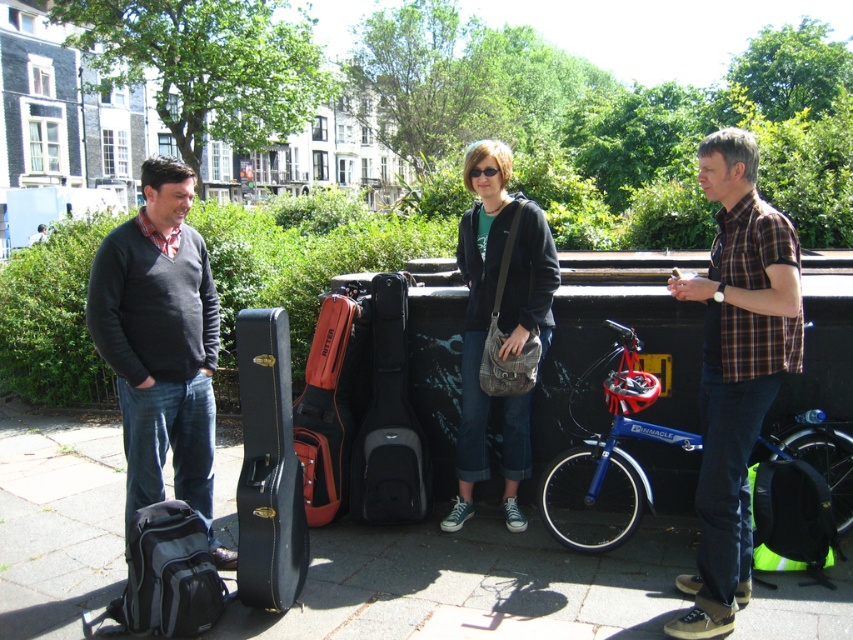
Question: Can you confirm if brown plaid shirt at right is positioned to the right of blue metallic bicycle at right?

Choices:
 (A) no
 (B) yes

Answer: (B)

Question: Which of the following is the closest to the observer?

Choices:
 (A) denim pants at center
 (B) brown plaid shirt at right
 (C) orange leather guitar case at center
 (D) blue metallic bicycle at right

Answer: (B)

Question: From the image, what is the correct spatial relationship of dark gray sweater at left in relation to black leather guitar case at center?

Choices:
 (A) below
 (B) above

Answer: (B)

Question: Which point is closer to the camera taking this photo?

Choices:
 (A) (607, 396)
 (B) (167, 416)
 (C) (488, 596)
 (D) (392, 358)

Answer: (C)

Question: Considering the real-world distances, which object is closest to the brown plaid shirt at right?

Choices:
 (A) orange leather guitar case at center
 (B) dark gray sweater at left
 (C) black leather guitar case at center
 (D) denim pants at center

Answer: (D)

Question: Observing the image, what is the correct spatial positioning of dark gray sweater at left in reference to denim pants at center?

Choices:
 (A) above
 (B) below

Answer: (B)